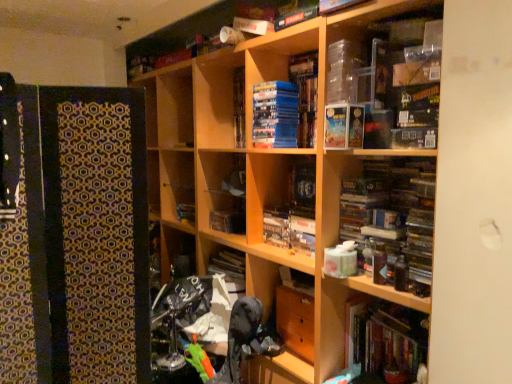
Question: Does hardcover books at lower right, which is counted as the second book, starting from the back, have a greater height compared to hardcover book at center, the 2th book positioned from the front?

Choices:
 (A) no
 (B) yes

Answer: (B)

Question: Is hardcover books at lower right, which appears as the 2th book when viewed from the top, not near hardcover book at center, the 1th book positioned from the back?

Choices:
 (A) no
 (B) yes

Answer: (A)

Question: Is hardcover books at lower right, which appears as the 2th book when viewed from the top, not inside hardcover book at center, the 2th book positioned from the right?

Choices:
 (A) no
 (B) yes

Answer: (B)

Question: Can you confirm if hardcover books at lower right, which is counted as the second book, starting from the back, is shorter than hardcover book at center, the 2th book positioned from the front?

Choices:
 (A) yes
 (B) no

Answer: (B)

Question: Can you confirm if hardcover books at lower right, which is counted as the second book, starting from the back, is smaller than hardcover book at center, arranged as the 1th book when viewed from the left?

Choices:
 (A) no
 (B) yes

Answer: (A)

Question: From a real-world perspective, is hardcover books at lower right, marked as the 2th book in a left-to-right arrangement, on top of hardcover book at center, the 2th book positioned from the right?

Choices:
 (A) yes
 (B) no

Answer: (B)

Question: Can you confirm if hardcover book at center, the 2th book in the bottom-to-top sequence, is positioned to the left of blue matte stack of books at center, placed as the 2th paperback book when sorted from front to back?

Choices:
 (A) yes
 (B) no

Answer: (A)

Question: From the image's perspective, is hardcover book at center, the 1th book positioned from the back, on blue matte stack of books at center, the first paperback book positioned from the back?

Choices:
 (A) yes
 (B) no

Answer: (B)

Question: Can you confirm if hardcover book at center, the 1th book positioned from the back, is shorter than blue matte stack of books at center, placed as the 2th paperback book when sorted from front to back?

Choices:
 (A) yes
 (B) no

Answer: (A)

Question: Can you confirm if hardcover book at center, which is the 1th book from top to bottom, is thinner than blue matte stack of books at center, the first paperback book positioned from the back?

Choices:
 (A) no
 (B) yes

Answer: (B)

Question: Is hardcover book at center, the 2th book in the bottom-to-top sequence, taller than blue matte stack of books at center, the first paperback book positioned from the back?

Choices:
 (A) no
 (B) yes

Answer: (A)

Question: Is hardcover book at center, the 1th book positioned from the back, positioned behind blue matte stack of books at center, the first paperback book positioned from the back?

Choices:
 (A) no
 (B) yes

Answer: (B)

Question: Is patterned fabric at left closer to camera compared to blue matte stack of books at center, the first paperback book positioned from the back?

Choices:
 (A) no
 (B) yes

Answer: (B)